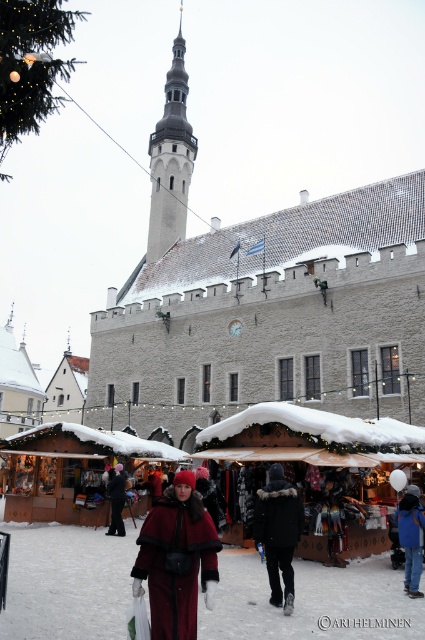
Question: Which point is farther from the camera taking this photo?

Choices:
 (A) (419, 556)
 (B) (121, 484)
 (C) (280, 484)

Answer: (B)

Question: Which point is farther to the camera?

Choices:
 (A) (113, 518)
 (B) (316, 412)
 (C) (178, 532)
 (D) (183, 118)

Answer: (D)

Question: Which of these objects is positioned closest to the dark blue jacket at lower right?

Choices:
 (A) black matte coat at lower left
 (B) white stone tower at upper center
 (C) snow-covered wooden stalls at center
 (D) black fur-trimmed coat at center

Answer: (D)

Question: In this image, where is velvet red coat at center located relative to dark blue jacket at lower right?

Choices:
 (A) below
 (B) above

Answer: (A)

Question: Can you confirm if velvet red coat at center is positioned below white stone tower at upper center?

Choices:
 (A) no
 (B) yes

Answer: (B)

Question: Can you confirm if snow-covered wooden stalls at center is wider than velvet red coat at center?

Choices:
 (A) yes
 (B) no

Answer: (A)